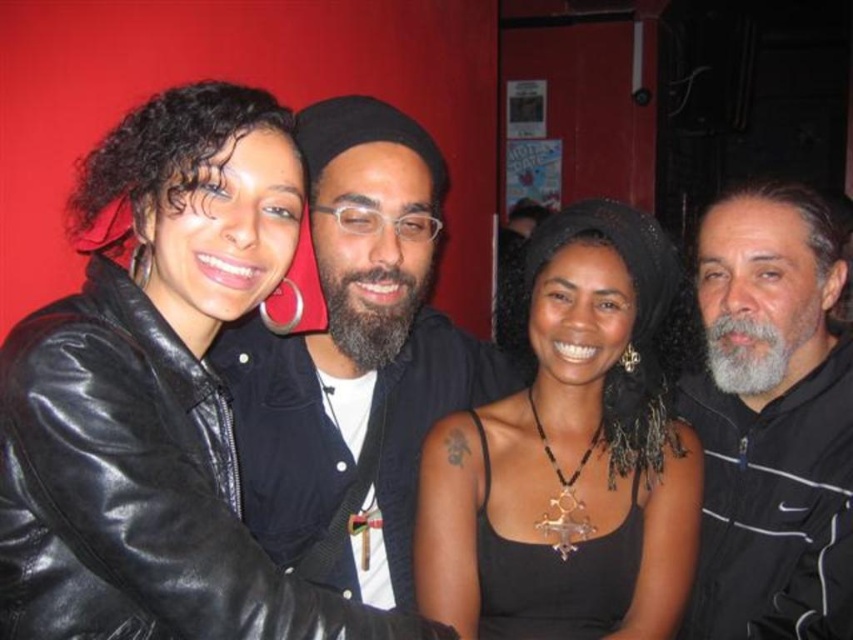
You are trying to decide which jacket to wear to a party. You have both the black leather jacket at upper left and the matte black jacket at center. Which one is larger?

The matte black jacket at center is larger than the black leather jacket at upper left.

You are standing in front of the image and want to know which of the two jackets is closer to you. The jackets in question are the black leather jacket at upper left and the matte black jacket at center. Can you determine which one is closer?

The black leather jacket at upper left is closer to you because it is positioned in front of the matte black jacket at center.